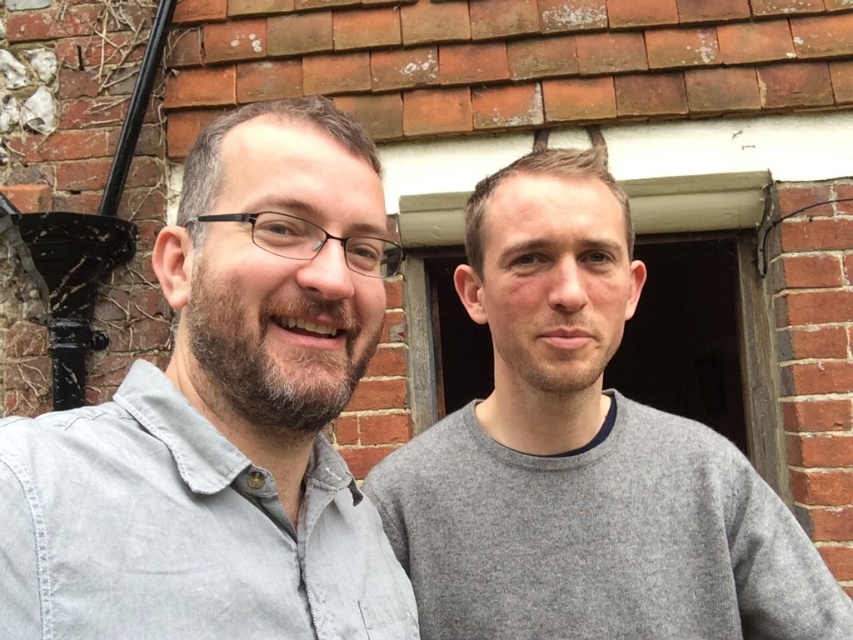
Question: Considering the relative positions of gray cotton shirt at left and gray wool sweater at right in the image provided, where is gray cotton shirt at left located with respect to gray wool sweater at right?

Choices:
 (A) right
 (B) left

Answer: (B)

Question: Can you confirm if gray cotton shirt at left is wider than gray wool sweater at right?

Choices:
 (A) no
 (B) yes

Answer: (A)

Question: Which point appears farthest from the camera in this image?

Choices:
 (A) (706, 556)
 (B) (213, 634)

Answer: (A)

Question: Among these points, which one is farthest from the camera?

Choices:
 (A) (193, 552)
 (B) (540, 516)

Answer: (B)

Question: Does gray cotton shirt at left appear over gray wool sweater at right?

Choices:
 (A) yes
 (B) no

Answer: (A)